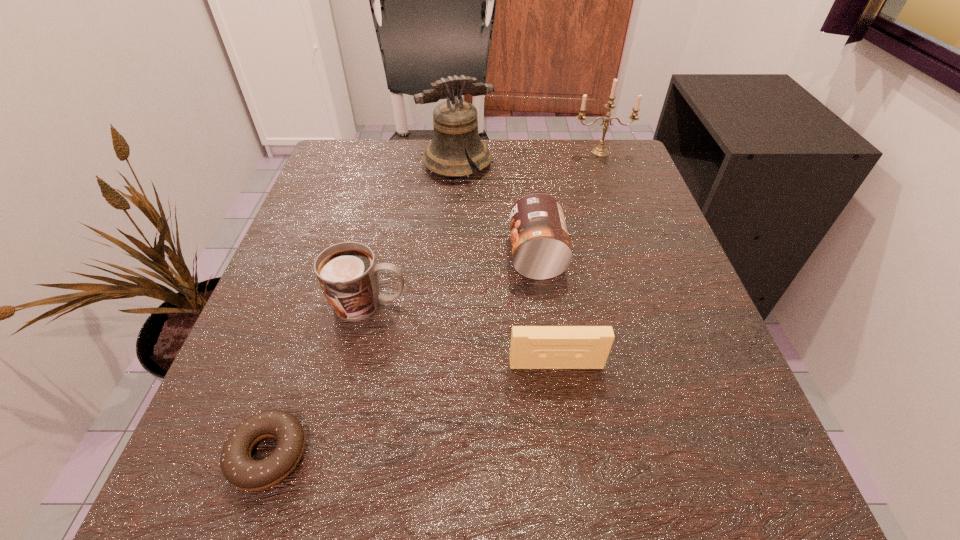
You are a GUI agent. You are given a task and a screenshot of the screen. Output one action in this format:
    pyautogui.click(x=<x>, y=<y>)
    Task: Click on the bell
    
    Given the screenshot: What is the action you would take?
    pyautogui.click(x=455, y=122)

The image size is (960, 540). I want to click on the rightmost object, so click(601, 151).

Identify the location of the third nearest object. The image size is (960, 540). pos(347,272).

Locate an element on the screen. The image size is (960, 540). the third farthest object is located at coordinates (541, 249).

Locate an element on the screen. The height and width of the screenshot is (540, 960). the fifth farthest object is located at coordinates (532, 347).

Locate an element on the screen. videotape is located at coordinates (532, 347).

Identify the location of the shortest object. Image resolution: width=960 pixels, height=540 pixels. (243, 472).

Locate an element on the screen. This screenshot has width=960, height=540. doughnut is located at coordinates (243, 472).

Find the location of a particular element. This screenshot has height=540, width=960. vacant space situated on the front of the bell is located at coordinates (454, 212).

Find the location of a particular element. blank area located on the front of the candle is located at coordinates (636, 252).